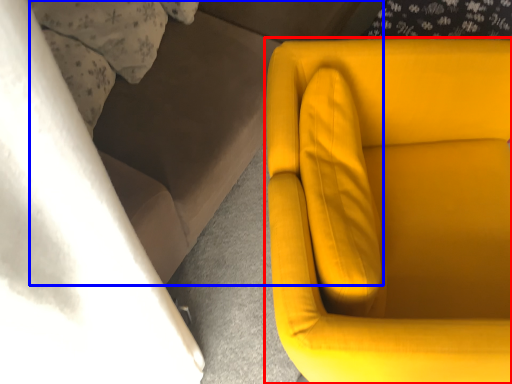
Question: Which object is further to the camera taking this photo, chair (highlighted by a red box) or couch (highlighted by a blue box)?

Choices:
 (A) chair
 (B) couch

Answer: (B)